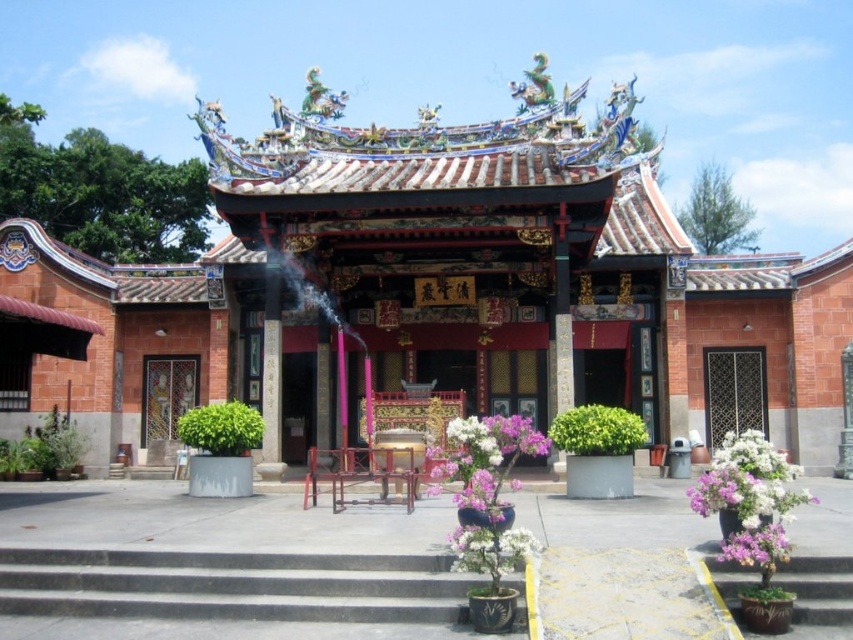
Question: Is purple glossy plant at center above purple matte flower pot at lower right?

Choices:
 (A) yes
 (B) no

Answer: (A)

Question: Is purple matte flower pot at lower right closer to the viewer compared to smooth concrete stairs at lower right?

Choices:
 (A) yes
 (B) no

Answer: (B)

Question: Considering the real-world distances, which object is closest to the purple matte flower pot at lower right?

Choices:
 (A) purple glossy plant at center
 (B) smooth concrete stairs at lower right
 (C) purple matte flowers at lower right

Answer: (C)

Question: Which object appears closest to the camera in this image?

Choices:
 (A) black metal gate at center
 (B) gray concrete stairs at lower center
 (C) purple matte flower pot at lower right
 (D) glossy ceramic altar at center

Answer: (B)

Question: Is glossy ceramic altar at center closer to the viewer compared to purple matte flower pot at lower right?

Choices:
 (A) no
 (B) yes

Answer: (A)

Question: Which of the following is the closest to the observer?

Choices:
 (A) black metal gate at center
 (B) smooth concrete stairs at lower right
 (C) purple matte flowers at lower right

Answer: (B)